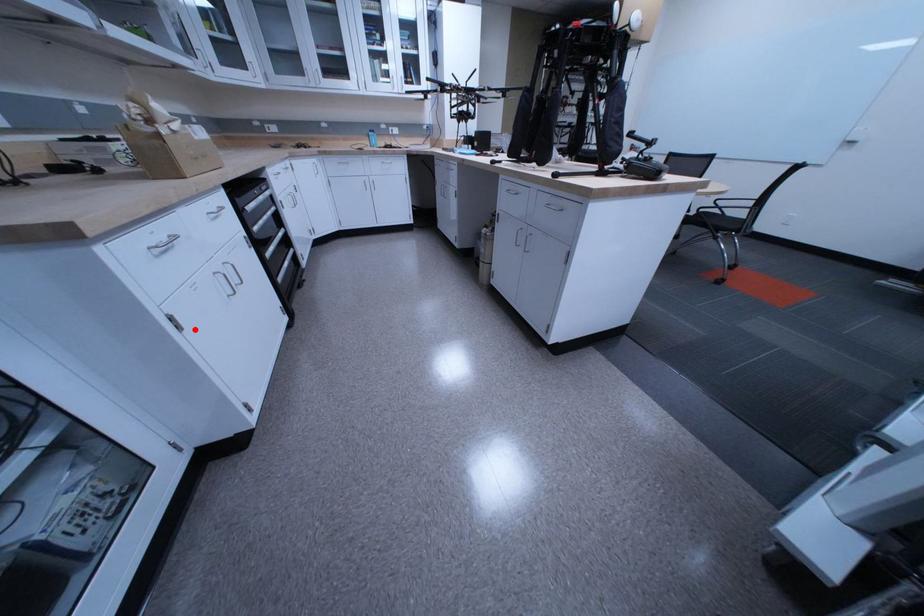
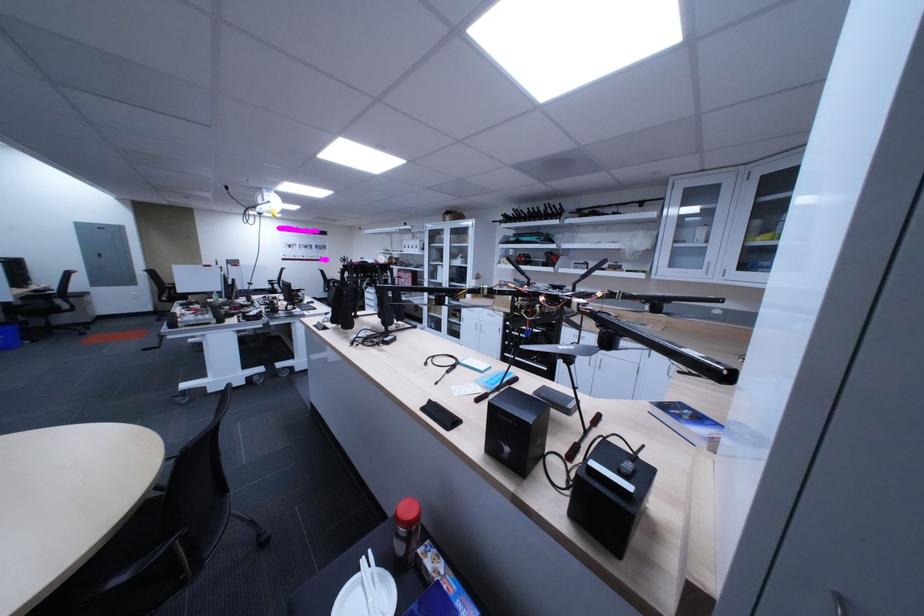
The point at the highlighted location is marked in the first image. Where is the corresponding point in the second image?

(478, 323)